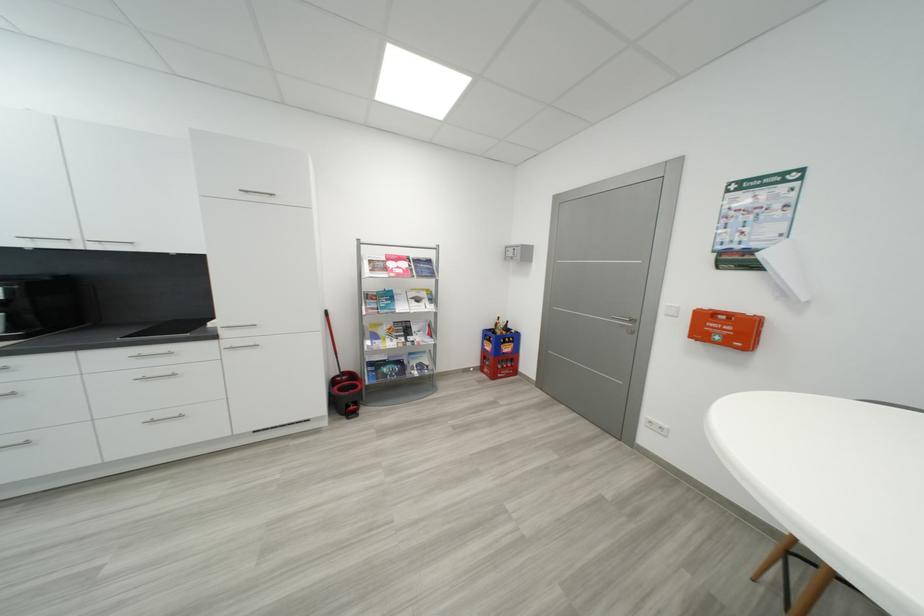
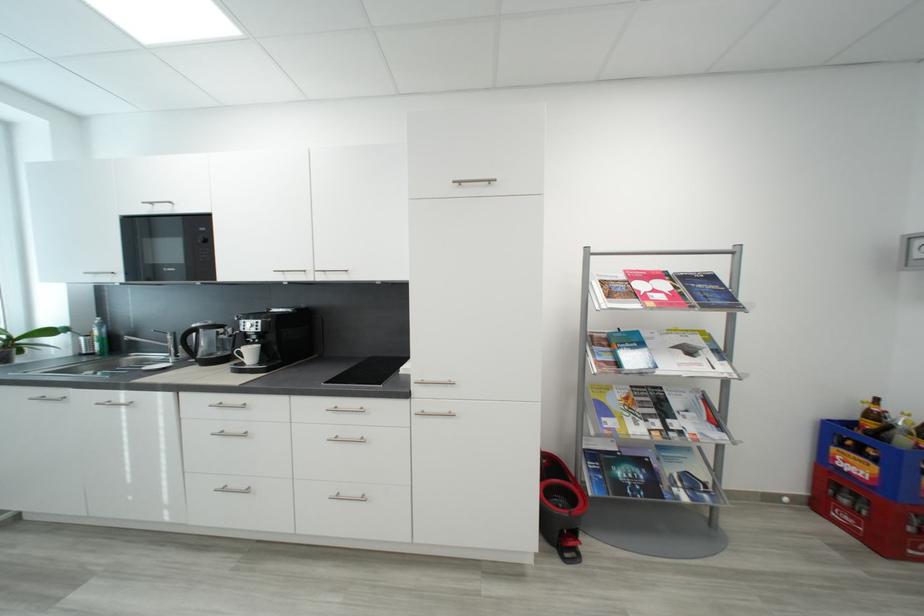
Locate, in the second image, the point that corresponds to point (424, 302) in the first image.

(697, 353)